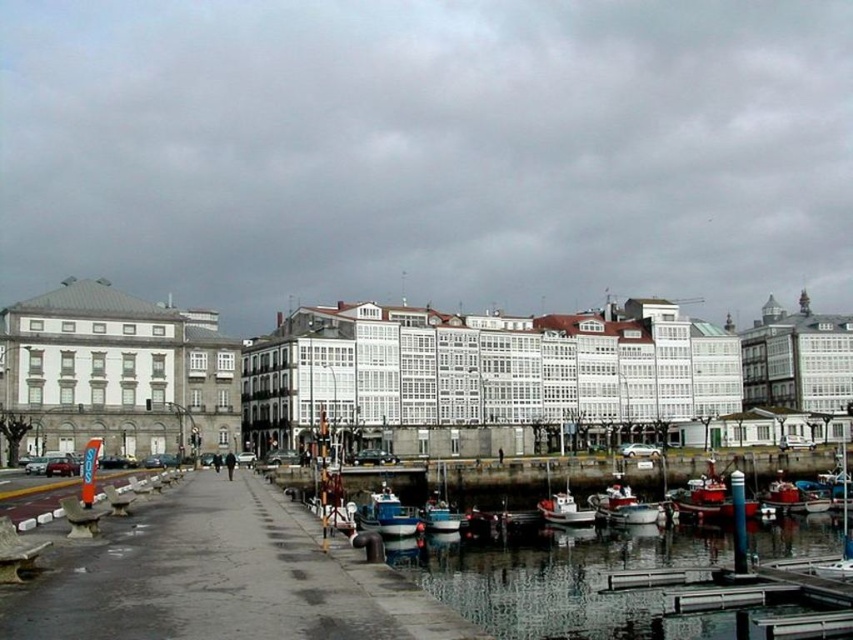
Question: Can you confirm if blue painted wooden boat at lower center is positioned below metallic blue boat at lower center?

Choices:
 (A) no
 (B) yes

Answer: (A)

Question: Which object is the closest to the white plastic boat at center?

Choices:
 (A) metallic blue boat at lower center
 (B) blue painted wooden boat at lower center

Answer: (A)

Question: Does blue painted wooden boat at lower center have a smaller size compared to metallic blue boat at lower center?

Choices:
 (A) no
 (B) yes

Answer: (B)

Question: Which point is closer to the camera?

Choices:
 (A) smooth glass water at lower right
 (B) white plastic boat at center
 (C) metallic blue boat at lower center

Answer: (A)

Question: Which of these objects is positioned farthest from the metallic blue boat at lower center?

Choices:
 (A) white plastic boat at center
 (B) blue wooden boat at center
 (C) smooth glass water at lower right

Answer: (B)

Question: Is smooth glass water at lower right in front of blue wooden boat at center?

Choices:
 (A) no
 (B) yes

Answer: (B)